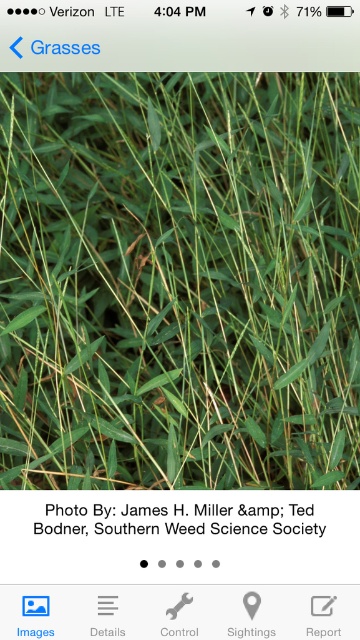
Consider the image. Which of these two, green matte grass at center or black paper at center, stands taller?

With more height is green matte grass at center.

Which is above, green matte grass at center or black paper at center?

green matte grass at center is higher up.

Between point (225, 333) and point (69, 532), which one is positioned behind?

The point (225, 333) is behind.

I want to click on green matte grass at center, so click(x=180, y=280).